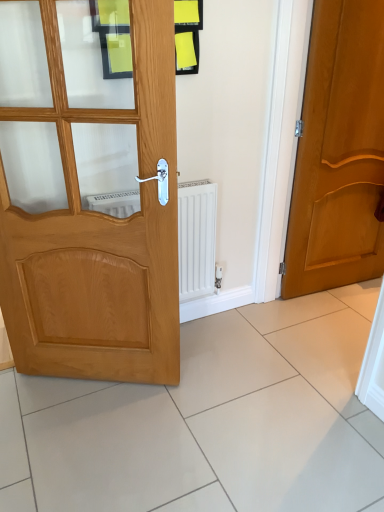
What are the coordinates of `empty space that is ontop of white glossy tile at lower right (from a real-world perspective)` in the screenshot? It's located at (x=344, y=304).